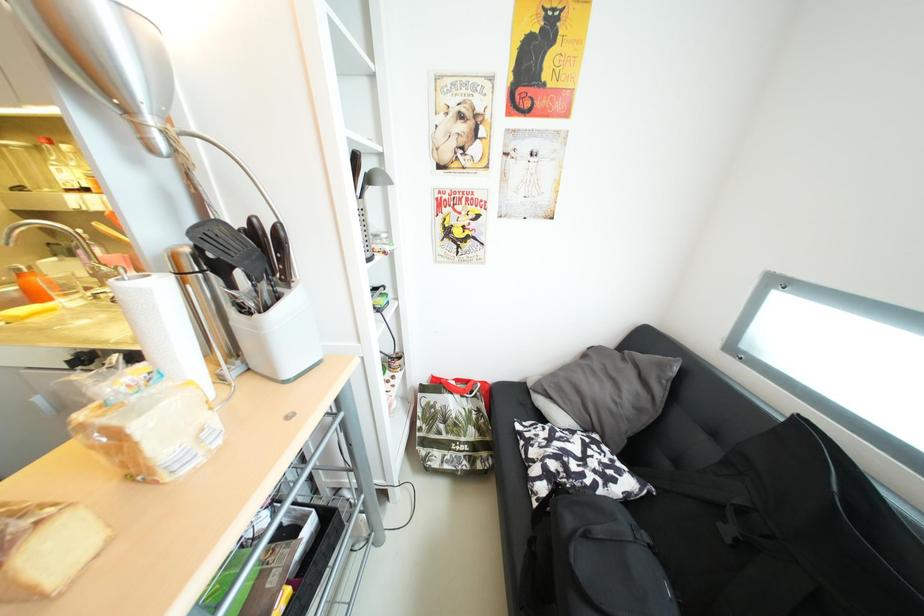
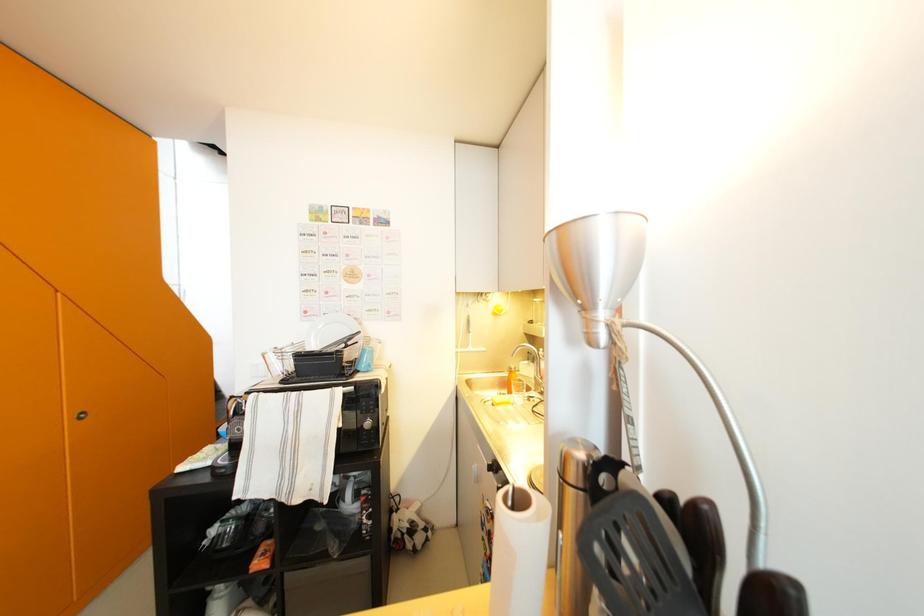
Question: The camera is either moving clockwise (left) or counter-clockwise (right) around the object. The first image is from the beginning of the video and the second image is from the end. Is the camera moving left or right when shooting the video?

Choices:
 (A) Left
 (B) Right

Answer: (B)